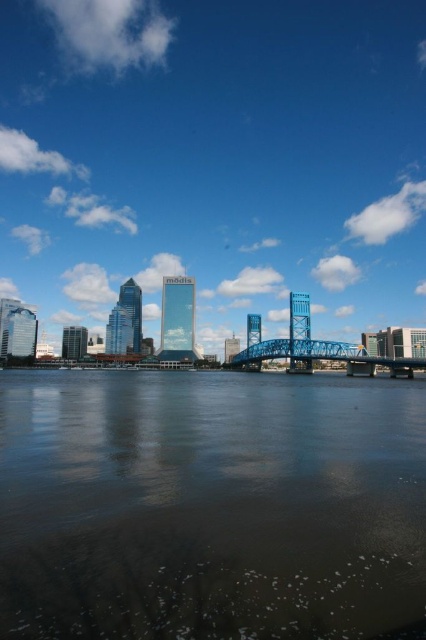
Image resolution: width=426 pixels, height=640 pixels. What do you see at coordinates (215, 160) in the screenshot?
I see `transparent glass bridge at center` at bounding box center [215, 160].

Who is shorter, transparent glass bridge at center or brown reflective water at center?

brown reflective water at center

Is point (83, 81) positioned before point (23, 458)?

No.

At what (x,y) coordinates should I click in order to perform the action: click on transparent glass bridge at center. Please return your answer as a coordinate pair (x, y). The height and width of the screenshot is (640, 426). Looking at the image, I should click on (215, 160).

Is transparent glass bridge at center smaller than blue metallic bridge at center?

Actually, transparent glass bridge at center might be larger than blue metallic bridge at center.

Does transparent glass bridge at center have a greater width compared to blue metallic bridge at center?

Yes.

Does point (106, 168) come farther from viewer compared to point (331, 356)?

Yes, it is behind point (331, 356).

At what (x,y) coordinates should I click in order to perform the action: click on transparent glass bridge at center. Please return your answer as a coordinate pair (x, y). This screenshot has width=426, height=640. Looking at the image, I should click on (215, 160).

Which is behind, point (316, 464) or point (348, 364)?

Point (348, 364)

Does point (92, 429) come closer to viewer compared to point (278, 340)?

Yes, point (92, 429) is in front of point (278, 340).

Is point (417, 477) in front of point (261, 355)?

Yes.

Identify the location of brown reflective water at center. [210, 506].